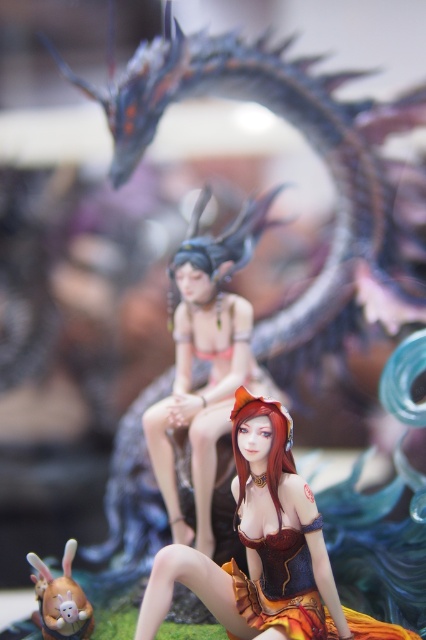
Question: Does satin gold dress at center appear on the left side of matte brown plush rabbit at lower left?

Choices:
 (A) no
 (B) yes

Answer: (A)

Question: Is shiny orange fabric dress at center bigger than matte brown plush rabbit at lower left?

Choices:
 (A) no
 (B) yes

Answer: (B)

Question: Can you confirm if shiny orange fabric dress at center is positioned to the left of matte brown plush rabbit at lower left?

Choices:
 (A) yes
 (B) no

Answer: (B)

Question: Which object is the farthest from the matte brown plush rabbit at lower left?

Choices:
 (A) shiny orange fabric dress at center
 (B) satin gold dress at center

Answer: (B)

Question: Which object appears closest to the camera in this image?

Choices:
 (A) satin gold dress at center
 (B) matte brown plush rabbit at lower left
 (C) shiny orange fabric dress at center

Answer: (C)

Question: Which of the following is the closest to the observer?

Choices:
 (A) shiny orange fabric dress at center
 (B) satin gold dress at center
 (C) matte brown plush rabbit at lower left

Answer: (A)